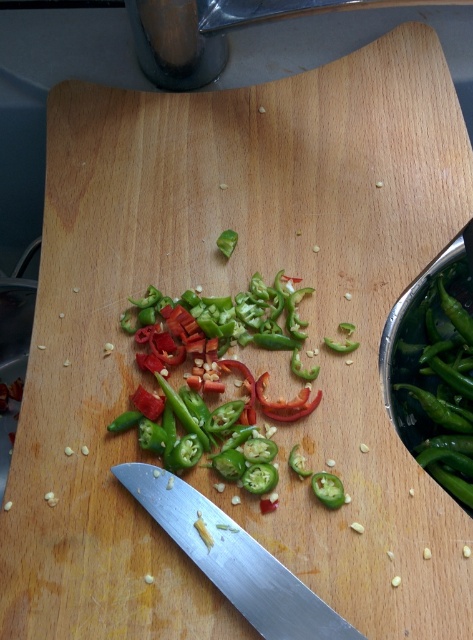
You are preparing a dish and need to cut the green glossy chili pepper at center. You have the silver metallic knife at lower center. Can you use this knife to cut the chili pepper? Explain why or why not based on their sizes.

The silver metallic knife at lower center has a smaller size compared to the green glossy chili pepper at center. Since the knife is smaller, it might not provide enough leverage or stability to effectively cut the larger chili pepper. A larger knife would be more appropriate for this task.

You are preparing a dish and need to move the green glossy chili pepper at center to the right side of the cutting board. Can you lift the chili pepper without moving the silver metallic knife at lower center?

The silver metallic knife at lower center is located below the green glossy chili pepper at center, so lifting the chili pepper would require moving the knife first to create space.